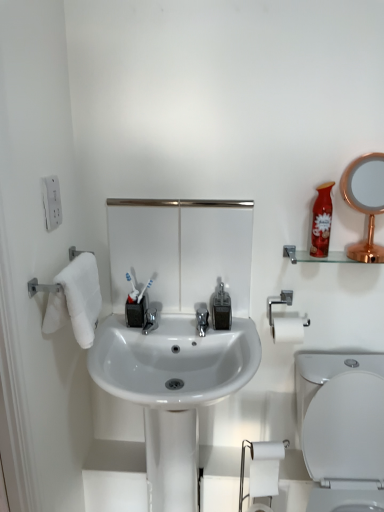
Question: Is white glossy sink at center not within white matte toilet paper at lower right?

Choices:
 (A) no
 (B) yes

Answer: (B)

Question: From a real-world perspective, is white glossy sink at center physically below white matte toilet paper at lower right?

Choices:
 (A) yes
 (B) no

Answer: (A)

Question: Considering the relative sizes of white glossy sink at center and white matte toilet paper at lower right in the image provided, is white glossy sink at center taller than white matte toilet paper at lower right?

Choices:
 (A) yes
 (B) no

Answer: (A)

Question: Can you confirm if white glossy sink at center is wider than white matte toilet paper at lower right?

Choices:
 (A) no
 (B) yes

Answer: (B)

Question: Is white glossy sink at center at the left side of white matte toilet paper at lower right?

Choices:
 (A) no
 (B) yes

Answer: (B)

Question: In the image, is translucent plastic soap dispenser at center on the left side or the right side of rose gold metallic mirror at upper right?

Choices:
 (A) left
 (B) right

Answer: (A)

Question: Is translucent plastic soap dispenser at center in front of or behind rose gold metallic mirror at upper right in the image?

Choices:
 (A) front
 (B) behind

Answer: (B)

Question: Considering the positions of translucent plastic soap dispenser at center and rose gold metallic mirror at upper right in the image, is translucent plastic soap dispenser at center taller or shorter than rose gold metallic mirror at upper right?

Choices:
 (A) tall
 (B) short

Answer: (B)

Question: Is translucent plastic soap dispenser at center inside or outside of rose gold metallic mirror at upper right?

Choices:
 (A) outside
 (B) inside

Answer: (A)

Question: From a real-world perspective, relative to shiny red plastic mouthwash at upper right, is white plastic outlet at upper left vertically above or below?

Choices:
 (A) above
 (B) below

Answer: (A)

Question: Is white plastic outlet at upper left inside or outside of shiny red plastic mouthwash at upper right?

Choices:
 (A) outside
 (B) inside

Answer: (A)

Question: From the image's perspective, is white plastic outlet at upper left above or below shiny red plastic mouthwash at upper right?

Choices:
 (A) below
 (B) above

Answer: (B)

Question: From their relative heights in the image, would you say white plastic outlet at upper left is taller or shorter than shiny red plastic mouthwash at upper right?

Choices:
 (A) short
 (B) tall

Answer: (A)

Question: Considering the positions of point [x=332, y=382] and point [x=175, y=330], is point [x=332, y=382] closer or farther from the camera than point [x=175, y=330]?

Choices:
 (A) closer
 (B) farther

Answer: (A)

Question: From the image's perspective, is white glossy toilet at lower right positioned above or below white glossy sink at center?

Choices:
 (A) above
 (B) below

Answer: (B)